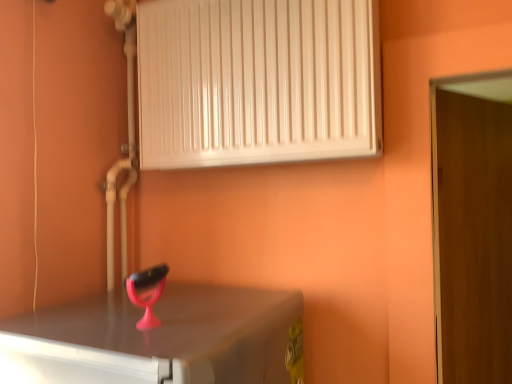
Question: Does white glossy radiator at upper center have a lesser height compared to wooden door at right?

Choices:
 (A) no
 (B) yes

Answer: (B)

Question: From the image's perspective, would you say white glossy radiator at upper center is shown under wooden door at right?

Choices:
 (A) yes
 (B) no

Answer: (B)

Question: Considering the relative sizes of white glossy radiator at upper center and wooden door at right in the image provided, is white glossy radiator at upper center smaller than wooden door at right?

Choices:
 (A) no
 (B) yes

Answer: (B)

Question: From a real-world perspective, is white glossy radiator at upper center located higher than wooden door at right?

Choices:
 (A) yes
 (B) no

Answer: (A)

Question: Is white glossy radiator at upper center oriented away from wooden door at right?

Choices:
 (A) no
 (B) yes

Answer: (A)

Question: From the image's perspective, would you say white glossy radiator at upper center is positioned over wooden door at right?

Choices:
 (A) no
 (B) yes

Answer: (B)

Question: Can we say wooden door at right lies outside white glossy radiator at upper center?

Choices:
 (A) no
 (B) yes

Answer: (B)

Question: Can you confirm if wooden door at right is smaller than white glossy radiator at upper center?

Choices:
 (A) no
 (B) yes

Answer: (A)

Question: From the image's perspective, is wooden door at right under white glossy radiator at upper center?

Choices:
 (A) no
 (B) yes

Answer: (B)

Question: Is wooden door at right at the left side of white glossy radiator at upper center?

Choices:
 (A) no
 (B) yes

Answer: (A)

Question: Is white glossy radiator at upper center inside wooden door at right?

Choices:
 (A) yes
 (B) no

Answer: (B)

Question: Is wooden door at right wider than white glossy radiator at upper center?

Choices:
 (A) no
 (B) yes

Answer: (A)

Question: Looking at their shapes, would you say wooden door at right is wider or thinner than white glossy radiator at upper center?

Choices:
 (A) thin
 (B) wide

Answer: (A)